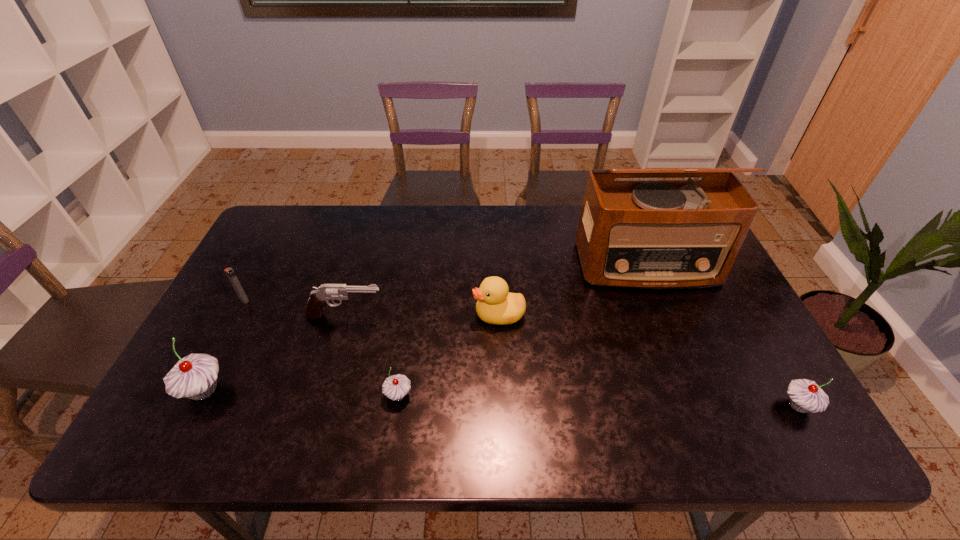
In order to click on free space located on the back of the second tallest object in this screenshot , I will do `click(231, 337)`.

You are a GUI agent. You are given a task and a screenshot of the screen. Output one action in this format:
    pyautogui.click(x=<x>, y=<y>)
    Task: Click on the vacant region located 0.110m on the left of the second cupcake from left to right
    This screenshot has width=960, height=540.
    Given the screenshot: What is the action you would take?
    pyautogui.click(x=338, y=395)

Locate an element on the screen. The width and height of the screenshot is (960, 540). free space located on the back of the rightmost cupcake is located at coordinates (778, 369).

Where is `free space located on the front of the igniter`? The height and width of the screenshot is (540, 960). free space located on the front of the igniter is located at coordinates (199, 386).

Identify the location of vacant position located on the front panel of the radio receiver. The height and width of the screenshot is (540, 960). (700, 394).

Find the location of `vacant space located 0.230m at the muzzle of the gun`. vacant space located 0.230m at the muzzle of the gun is located at coordinates click(x=468, y=316).

Identify the location of free space located at the beak of the third object from right to left. The image size is (960, 540). (339, 315).

Find the location of `vacant space located 0.170m at the beak of the third object from right to left`. vacant space located 0.170m at the beak of the third object from right to left is located at coordinates (411, 315).

Where is `vacant region located at the beak of the third object from right to left`? The height and width of the screenshot is (540, 960). vacant region located at the beak of the third object from right to left is located at coordinates (444, 315).

The image size is (960, 540). I want to click on object that is positioned at the far edge, so click(x=655, y=234).